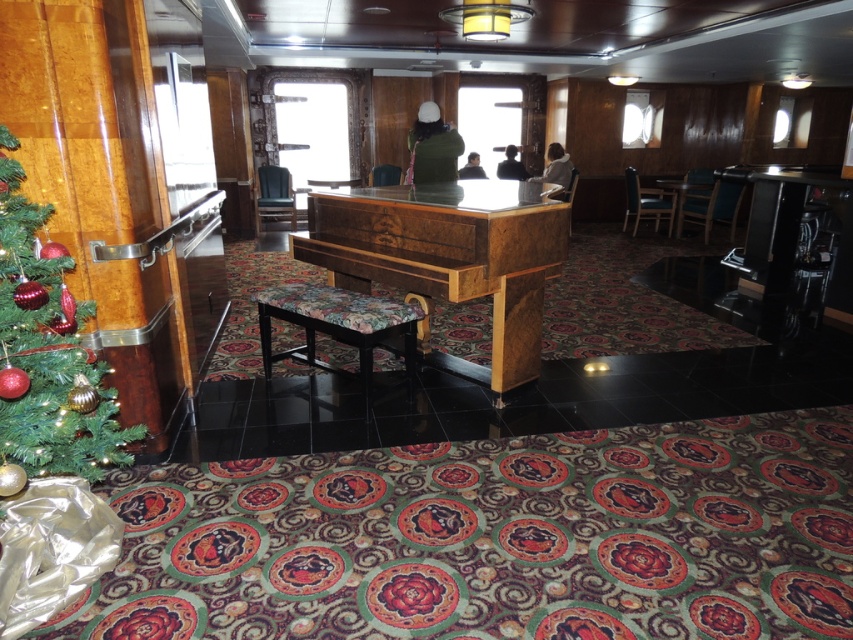
Question: Estimate the real-world distances between objects in this image. Which object is closer to the wooden table at center?

Choices:
 (A) floral fabric stool at center
 (B) wooden piano at center
 (C) green matte christmas tree at left

Answer: (B)

Question: Is green matte christmas tree at left above floral fabric stool at center?

Choices:
 (A) yes
 (B) no

Answer: (A)

Question: Is floral fabric stool at center wider than wooden table at center?

Choices:
 (A) yes
 (B) no

Answer: (A)

Question: Does wooden piano at center have a smaller size compared to floral fabric stool at center?

Choices:
 (A) yes
 (B) no

Answer: (B)

Question: Which point is closer to the camera taking this photo?

Choices:
 (A) (329, 369)
 (B) (9, 436)
 (C) (706, 193)

Answer: (B)

Question: Estimate the real-world distances between objects in this image. Which object is closer to the floral fabric stool at center?

Choices:
 (A) wooden piano at center
 (B) green matte christmas tree at left

Answer: (A)